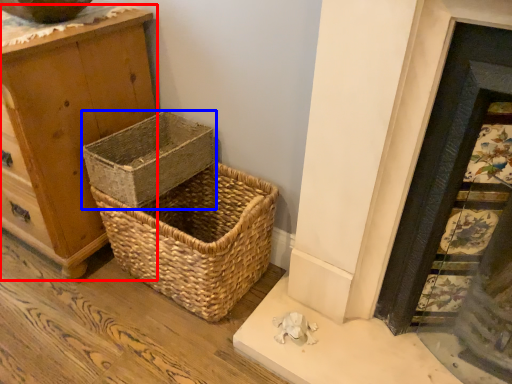
Question: Which object is further to the camera taking this photo, chest of drawers (highlighted by a red box) or picnic basket (highlighted by a blue box)?

Choices:
 (A) chest of drawers
 (B) picnic basket

Answer: (B)